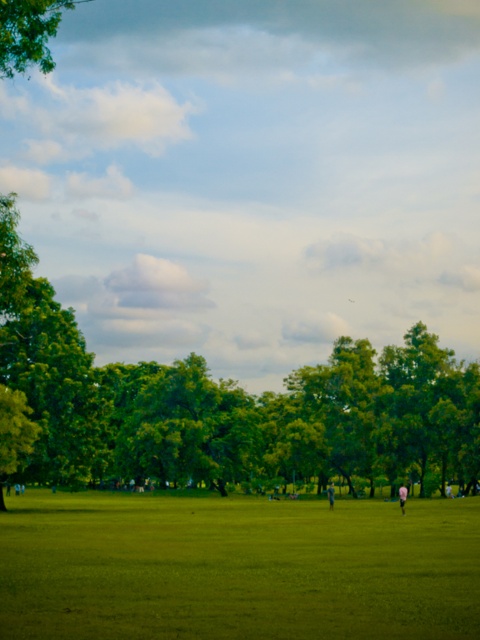
Question: Which of the following is the farthest from the observer?

Choices:
 (A) green grassy field at center
 (B) pink fabric person at center

Answer: (B)

Question: Which of the following is the farthest from the observer?

Choices:
 (A) (400, 497)
 (B) (455, 540)

Answer: (A)

Question: Is green grassy field at center thinner than light blue cotton shirt at center?

Choices:
 (A) no
 (B) yes

Answer: (A)

Question: Is green grassy field at center below light blue cotton shirt at center?

Choices:
 (A) yes
 (B) no

Answer: (B)

Question: Which of the following is the farthest from the observer?

Choices:
 (A) (330, 508)
 (B) (398, 499)

Answer: (B)

Question: Can you confirm if green grassy field at center is bigger than light blue cotton shirt at center?

Choices:
 (A) no
 (B) yes

Answer: (B)